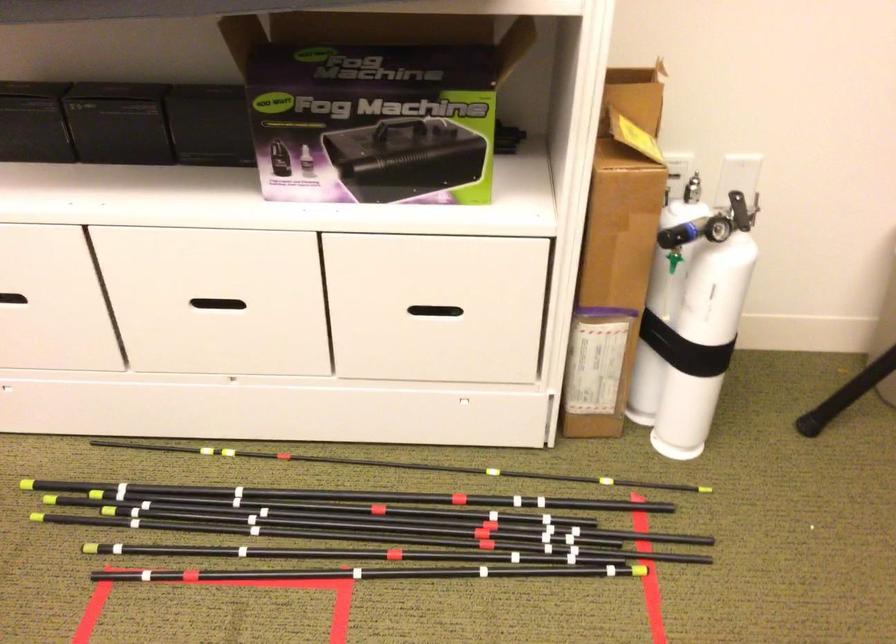
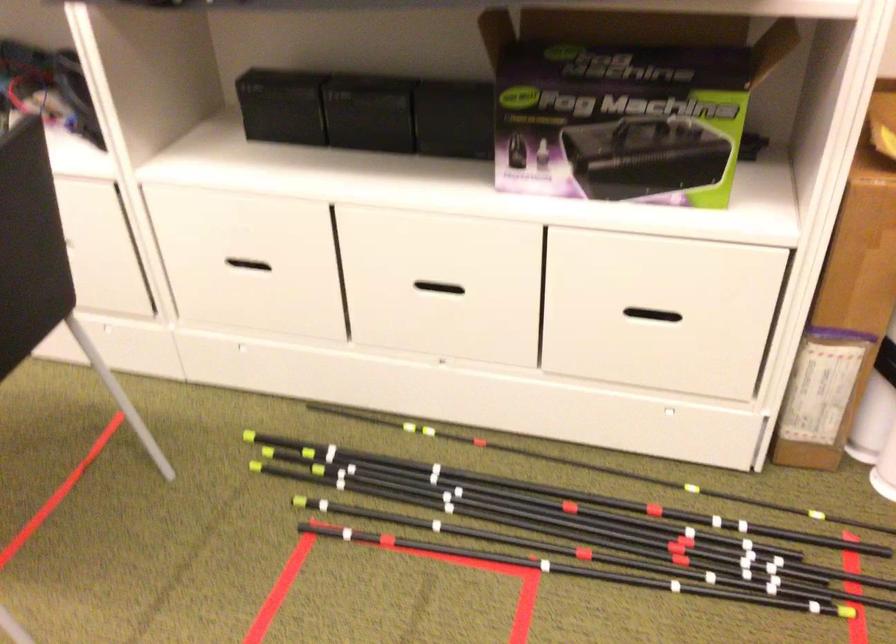
Where in the second image is the point corresponding to (x=208, y=128) from the first image?

(453, 118)